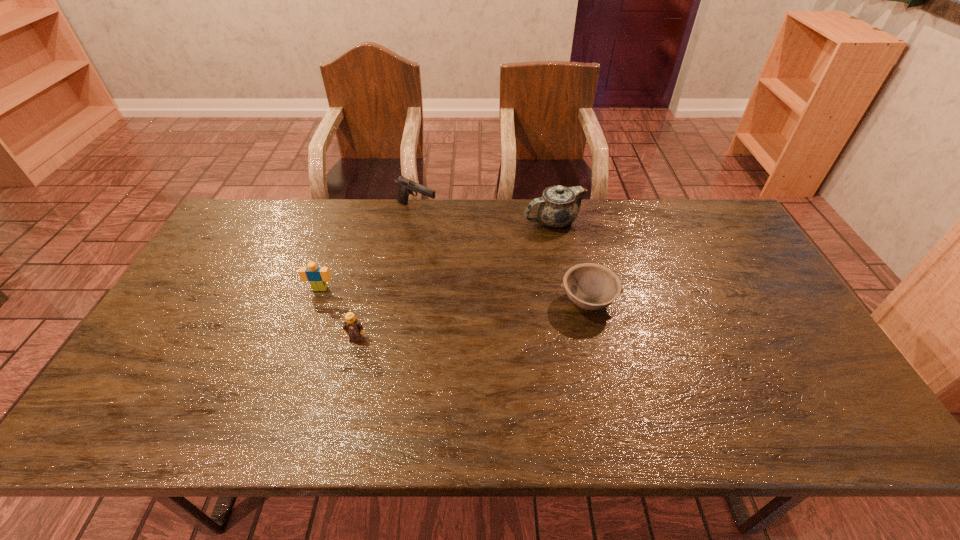
Where is `chinaware`? This screenshot has height=540, width=960. chinaware is located at coordinates (558, 207).

Find the location of a particular element. gun is located at coordinates (406, 186).

Locate an element on the screen. This screenshot has height=540, width=960. the farther Lego is located at coordinates (317, 276).

At what (x,y) coordinates should I click in order to perform the action: click on the leftmost object. Please return your answer as a coordinate pair (x, y). This screenshot has height=540, width=960. Looking at the image, I should click on (317, 276).

The width and height of the screenshot is (960, 540). I want to click on the nearest object, so click(x=354, y=328).

You are a GUI agent. You are given a task and a screenshot of the screen. Output one action in this format:
    pyautogui.click(x=<x>, y=<y>)
    Task: Click on the right Lego
    This screenshot has width=960, height=540.
    Given the screenshot: What is the action you would take?
    pyautogui.click(x=354, y=328)

The height and width of the screenshot is (540, 960). Find the location of `bowl`. bowl is located at coordinates (590, 286).

Identify the location of free point located 0.350m from the spout of the tallest object. Image resolution: width=960 pixels, height=540 pixels. (420, 221).

The image size is (960, 540). Find the location of `vacant space located 0.150m from the spout of the tallest object`. vacant space located 0.150m from the spout of the tallest object is located at coordinates (x=478, y=221).

Where is `vacant area situated from the spout of the tallest object`? The height and width of the screenshot is (540, 960). vacant area situated from the spout of the tallest object is located at coordinates (464, 221).